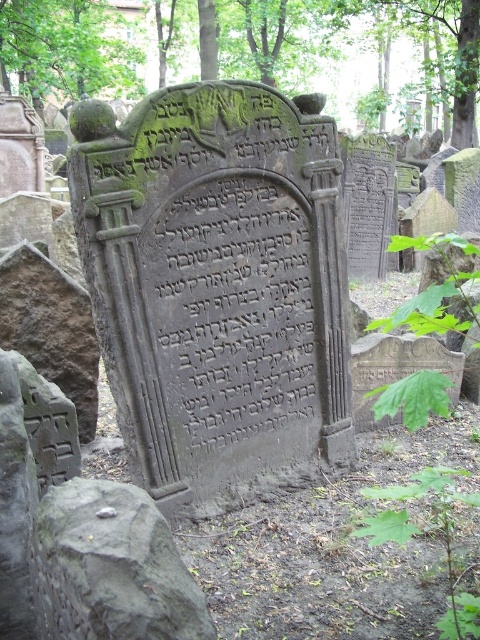
Question: Which object is positioned farthest from the green mossy tree at upper center?

Choices:
 (A) gray stone at center
 (B) green leafy tree at upper left
 (C) green mossy stone monument at center

Answer: (A)

Question: Is the position of black stone inscription at center more distant than that of green leafy tree at upper left?

Choices:
 (A) yes
 (B) no

Answer: (B)

Question: Is green mossy tree at upper center positioned at the back of black stone inscription at center?

Choices:
 (A) yes
 (B) no

Answer: (A)

Question: Which object is the farthest from the green leafy tree at upper left?

Choices:
 (A) gray stone at center
 (B) black stone inscription at center

Answer: (A)

Question: Which point is closer to the camera?

Choices:
 (A) green leafy tree at upper left
 (B) green mossy tree at upper center
 (C) green mossy stone monument at center
 (D) gray stone at center

Answer: (D)

Question: Is green mossy tree at upper center below gray stone at center?

Choices:
 (A) yes
 (B) no

Answer: (B)